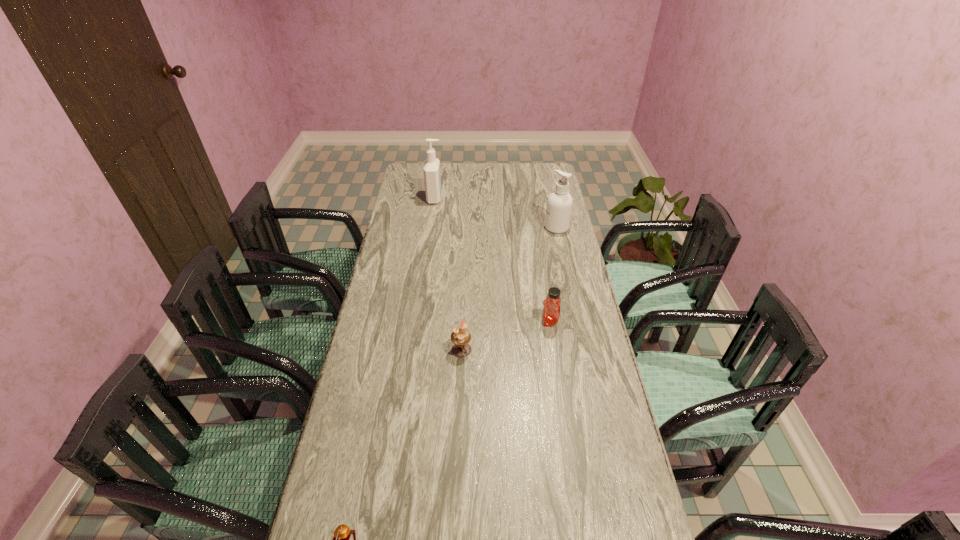
The height and width of the screenshot is (540, 960). What are the coordinates of `vacant point that satisfies the following two spatial constraints: 1. on the back side of the fourth farthest object; 2. on the front label of the farthest object` in the screenshot? It's located at pyautogui.click(x=468, y=198).

The width and height of the screenshot is (960, 540). In order to click on vacant space that satisfies the following two spatial constraints: 1. on the front label of the left cleansing agent; 2. on the left side of the candle holder in this screenshot , I will do `click(414, 349)`.